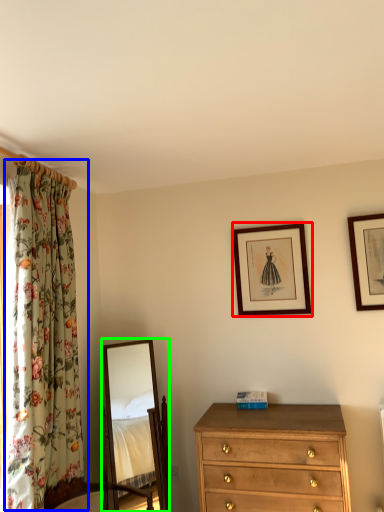
Question: Which object is positioned closest to picture frame (highlighted by a red box)? Select from curtain (highlighted by a blue box) and mirror (highlighted by a green box).

Choices:
 (A) curtain
 (B) mirror

Answer: (A)